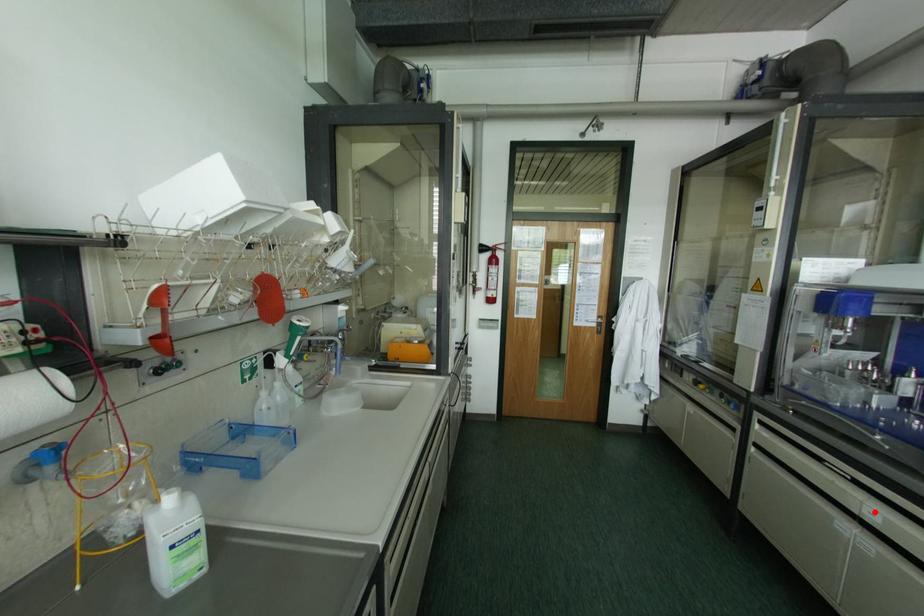
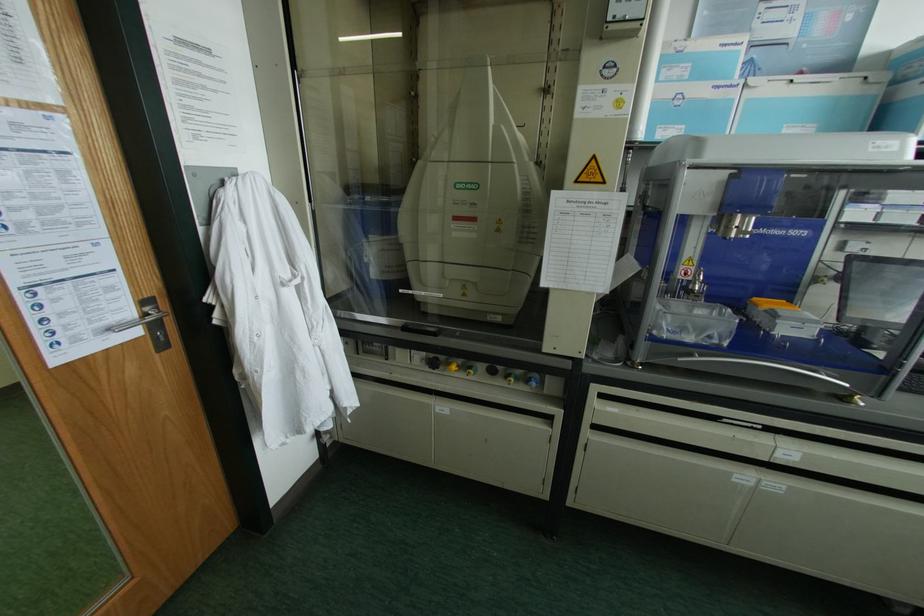
Question: I am providing you with two images of the same scene from different viewpoints. A red point is marked on the first image. At the location where the point appears in image 1, is it still visible in image 2?

Choices:
 (A) Yes
 (B) No

Answer: (A)